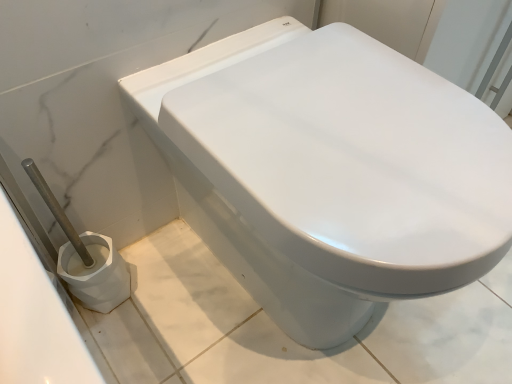
Image resolution: width=512 pixels, height=384 pixels. What do you see at coordinates (271, 222) in the screenshot?
I see `white glossy toilet at center` at bounding box center [271, 222].

Find the location of a particular element. This screenshot has width=512, height=384. white glossy toilet at center is located at coordinates (271, 222).

I want to click on white glossy toilet at center, so click(x=271, y=222).